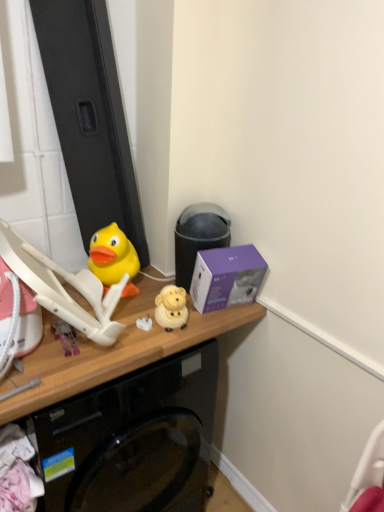
Locate an element on the screen. Image resolution: width=384 pixels, height=512 pixels. vacant point to the left of white matte plug at center, which is the 2th toy from right to left is located at coordinates (117, 322).